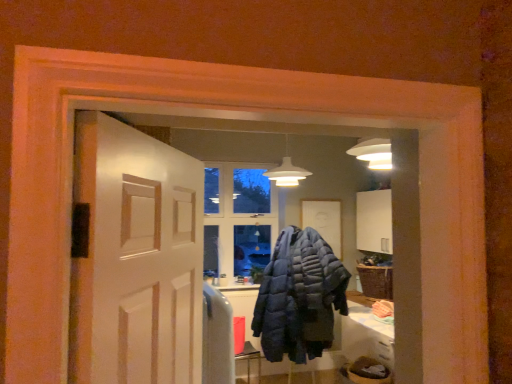
Question: Do you think dark blue quilted jacket at center is within white glossy door at center, or outside of it?

Choices:
 (A) inside
 (B) outside

Answer: (B)

Question: Considering the positions of point (270, 296) and point (145, 233), is point (270, 296) closer or farther from the camera than point (145, 233)?

Choices:
 (A) farther
 (B) closer

Answer: (A)

Question: From a real-world perspective, is dark blue quilted jacket at center physically located above or below white glossy door at center?

Choices:
 (A) below
 (B) above

Answer: (A)

Question: Is white glossy door at center bigger or smaller than dark blue quilted jacket at center?

Choices:
 (A) big
 (B) small

Answer: (B)

Question: From a real-world perspective, relative to dark blue quilted jacket at center, is white glossy door at center vertically above or below?

Choices:
 (A) above
 (B) below

Answer: (A)

Question: Is white glossy door at center situated inside dark blue quilted jacket at center or outside?

Choices:
 (A) inside
 (B) outside

Answer: (B)

Question: Does point (91, 165) appear closer or farther from the camera than point (261, 289)?

Choices:
 (A) farther
 (B) closer

Answer: (B)